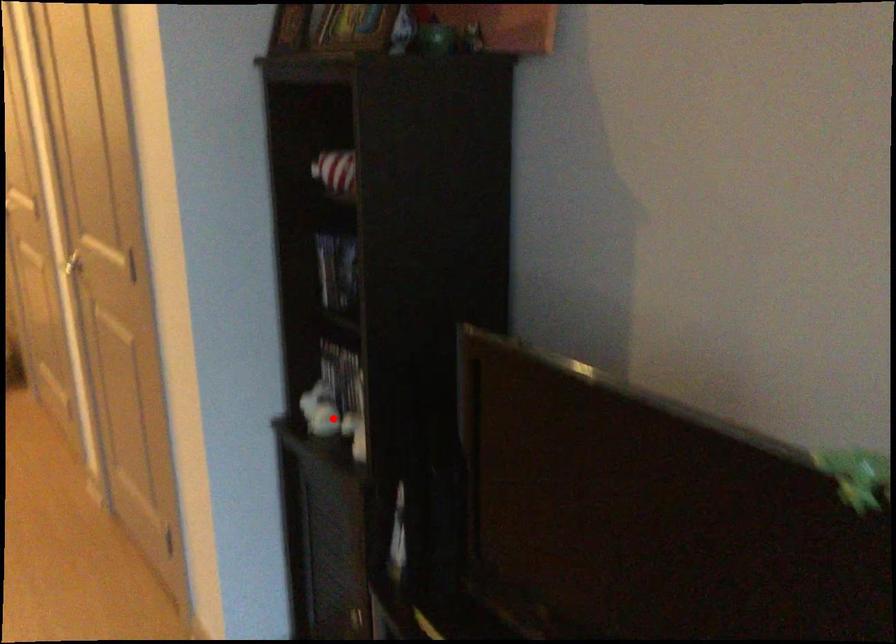
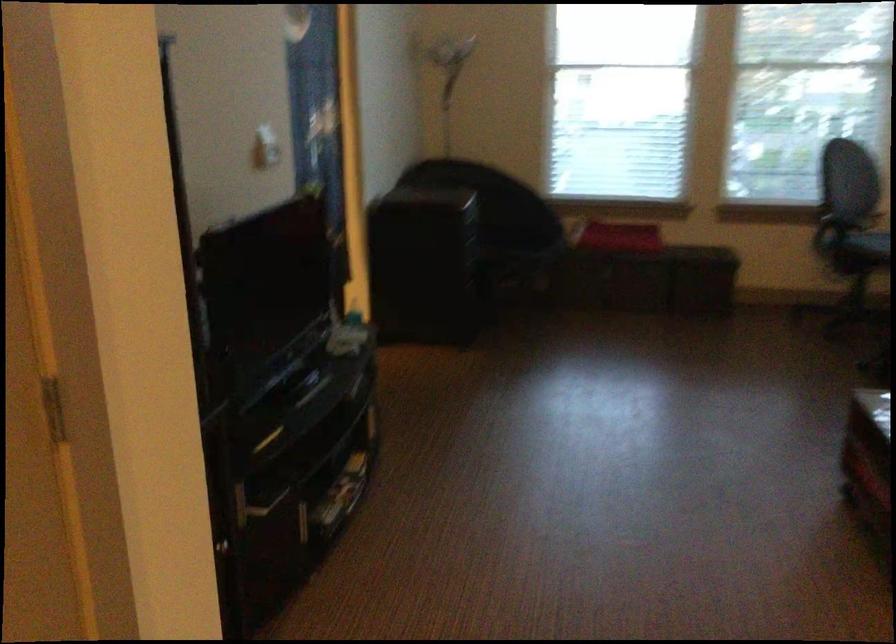
Question: I am providing you with two images of the same scene from different viewpoints. A red point is marked on the first image. At the location where the point appears in image 1, is it still visible in image 2?

Choices:
 (A) Yes
 (B) No

Answer: (B)